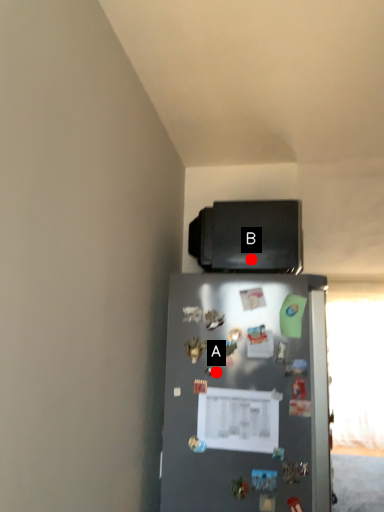
Question: Two points are circled on the image, labeled by A and B beside each circle. Which of the following is the farthest from the observer?

Choices:
 (A) A is further
 (B) B is further

Answer: (B)